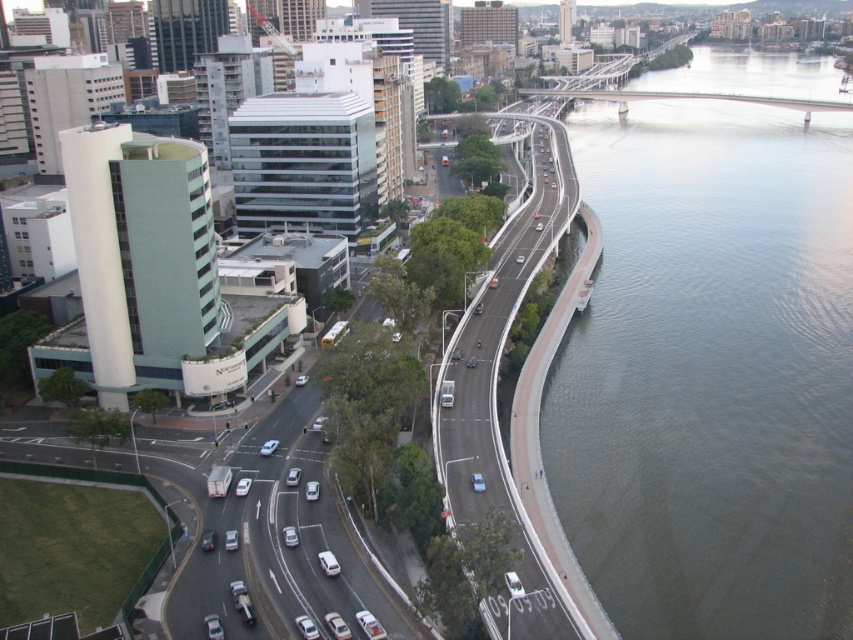
Which is more to the left, dark gray water at right or smooth asphalt highway at center right?

From the viewer's perspective, smooth asphalt highway at center right appears more on the left side.

Can you confirm if dark gray water at right is thinner than smooth asphalt highway at center right?

No.

What do you see at coordinates (711, 372) in the screenshot?
I see `dark gray water at right` at bounding box center [711, 372].

Locate an element on the screen. This screenshot has width=853, height=640. dark gray water at right is located at coordinates (711, 372).